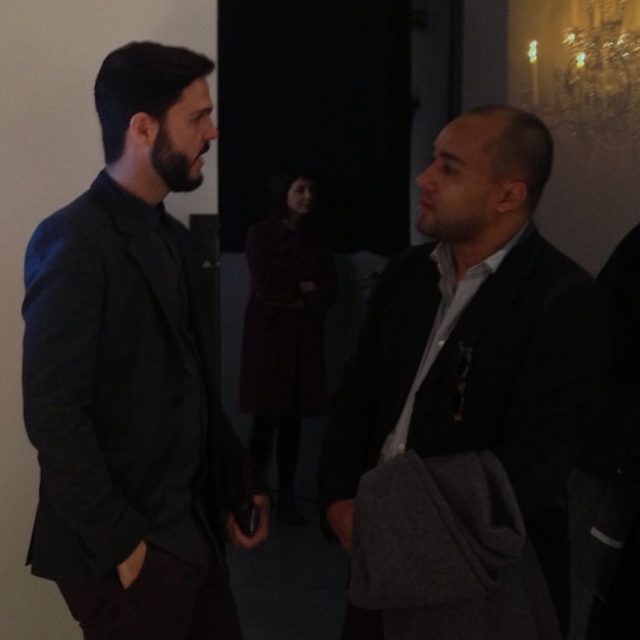
Between point (150, 557) and point (609, 484), which one is positioned in front?

Point (150, 557) is more forward.

Is matte black suit at left bigger than dark gray suit at right?

Correct, matte black suit at left is larger in size than dark gray suit at right.

Measure the distance between point (152, 161) and camera.

A distance of 1.35 meters exists between point (152, 161) and camera.

Locate an element on the screen. The image size is (640, 640). matte black suit at left is located at coordinates (132, 376).

Consider the image. Which is above, matte black jacket at right or dark gray suit at right?

matte black jacket at right is above.

Can you confirm if matte black jacket at right is positioned above dark gray suit at right?

Correct, matte black jacket at right is located above dark gray suit at right.

Locate an element on the screen. matte black jacket at right is located at coordinates (476, 339).

Is the position of matte black suit at left more distant than that of matte black jacket at right?

Yes, it is behind matte black jacket at right.

Is matte black suit at left to the left of matte black jacket at right from the viewer's perspective?

Correct, you'll find matte black suit at left to the left of matte black jacket at right.

Between point (93, 452) and point (349, 486), which one is positioned behind?

The point (349, 486) is behind.

You are a GUI agent. You are given a task and a screenshot of the screen. Output one action in this format:
    pyautogui.click(x=<x>, y=<y>)
    Task: Click on the matte black suit at left
    The height and width of the screenshot is (640, 640).
    Given the screenshot: What is the action you would take?
    pyautogui.click(x=132, y=376)